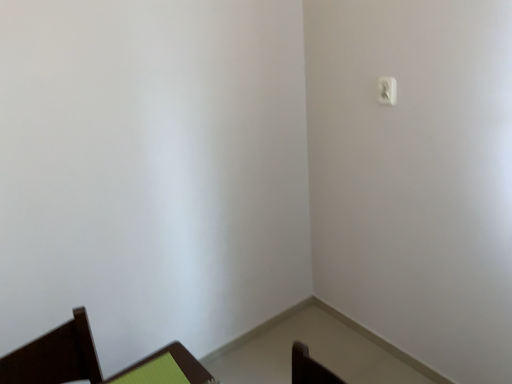
The height and width of the screenshot is (384, 512). I want to click on white plastic light switch at upper right, so click(387, 91).

What do you see at coordinates (387, 91) in the screenshot?
I see `white plastic light switch at upper right` at bounding box center [387, 91].

At what (x,y) coordinates should I click in order to perform the action: click on green fabric chair at lower left. Please return your answer as a coordinate pair (x, y). This screenshot has width=512, height=384. Looking at the image, I should click on (165, 369).

What do you see at coordinates (165, 369) in the screenshot? The width and height of the screenshot is (512, 384). I see `green fabric chair at lower left` at bounding box center [165, 369].

Locate an element on the screen. This screenshot has width=512, height=384. white plastic light switch at upper right is located at coordinates (387, 91).

Considering the positions of objects white plastic light switch at upper right and green fabric chair at lower left in the image provided, who is more to the right, white plastic light switch at upper right or green fabric chair at lower left?

white plastic light switch at upper right.

In the image, is white plastic light switch at upper right positioned in front of or behind green fabric chair at lower left?

white plastic light switch at upper right is behind green fabric chair at lower left.

Is point (382, 90) closer or farther from the camera than point (170, 362)?

Point (382, 90) appears to be farther away from the viewer than point (170, 362).

From the image's perspective, which one is positioned lower, white plastic light switch at upper right or green fabric chair at lower left?

green fabric chair at lower left, from the image's perspective.

From the picture: From a real-world perspective, is white plastic light switch at upper right positioned under green fabric chair at lower left based on gravity?

No, from a real-world perspective, white plastic light switch at upper right is not beneath green fabric chair at lower left.

In terms of width, does white plastic light switch at upper right look wider or thinner when compared to green fabric chair at lower left?

Clearly, white plastic light switch at upper right has less width compared to green fabric chair at lower left.

Looking at this image, in terms of height, does white plastic light switch at upper right look taller or shorter compared to green fabric chair at lower left?

In the image, white plastic light switch at upper right appears to be taller than green fabric chair at lower left.

Does white plastic light switch at upper right have a smaller size compared to green fabric chair at lower left?

Yes.

Choose the correct answer: Is white plastic light switch at upper right inside green fabric chair at lower left or outside it?

white plastic light switch at upper right cannot be found inside green fabric chair at lower left.

Would you consider white plastic light switch at upper right to be distant from green fabric chair at lower left?

Yes.

Is green fabric chair at lower left at the back of white plastic light switch at upper right?

white plastic light switch at upper right does not have its back to green fabric chair at lower left.

How many degrees apart are the facing directions of white plastic light switch at upper right and green fabric chair at lower left?

The facing directions of white plastic light switch at upper right and green fabric chair at lower left are 88.5 degrees apart.

Locate an element on the screen. light switch behind the green fabric chair at lower left is located at coordinates (387, 91).

Considering the positions of objects green fabric chair at lower left and white plastic light switch at upper right in the image provided, who is more to the left, green fabric chair at lower left or white plastic light switch at upper right?

Positioned to the left is green fabric chair at lower left.

Which object is more forward, green fabric chair at lower left or white plastic light switch at upper right?

green fabric chair at lower left is closer to the camera.

Does point (200, 371) come farther from viewer compared to point (393, 104)?

No, (200, 371) is closer to viewer.

From the image's perspective, is green fabric chair at lower left above white plastic light switch at upper right?

No, from the image's perspective, green fabric chair at lower left is not over white plastic light switch at upper right.

From a real-world perspective, between green fabric chair at lower left and white plastic light switch at upper right, who is vertically lower?

From a 3D spatial view, green fabric chair at lower left is below.

Is green fabric chair at lower left wider or thinner than white plastic light switch at upper right?

Considering their sizes, green fabric chair at lower left looks broader than white plastic light switch at upper right.

Can you confirm if green fabric chair at lower left is shorter than white plastic light switch at upper right?

Yes.

Between green fabric chair at lower left and white plastic light switch at upper right, which one has smaller size?

With smaller size is white plastic light switch at upper right.

Is green fabric chair at lower left outside of white plastic light switch at upper right?

Absolutely, green fabric chair at lower left is external to white plastic light switch at upper right.

Consider the image. Is green fabric chair at lower left next to white plastic light switch at upper right?

green fabric chair at lower left is not next to white plastic light switch at upper right, and they're not touching.

Is green fabric chair at lower left aimed at white plastic light switch at upper right?

No, green fabric chair at lower left is not facing towards white plastic light switch at upper right.

What's the angular difference between green fabric chair at lower left and white plastic light switch at upper right's facing directions?

The angle between the facing direction of green fabric chair at lower left and the facing direction of white plastic light switch at upper right is 88.5 degrees.

You are a GUI agent. You are given a task and a screenshot of the screen. Output one action in this format:
    pyautogui.click(x=<x>, y=<y>)
    Task: Click on the light switch located above the green fabric chair at lower left (from a real-world perspective)
    
    Given the screenshot: What is the action you would take?
    pyautogui.click(x=387, y=91)

Identify the location of furniture on the left of the white plastic light switch at upper right. The height and width of the screenshot is (384, 512). (165, 369).

Where is `furniture in front of the white plastic light switch at upper right`? furniture in front of the white plastic light switch at upper right is located at coordinates (165, 369).